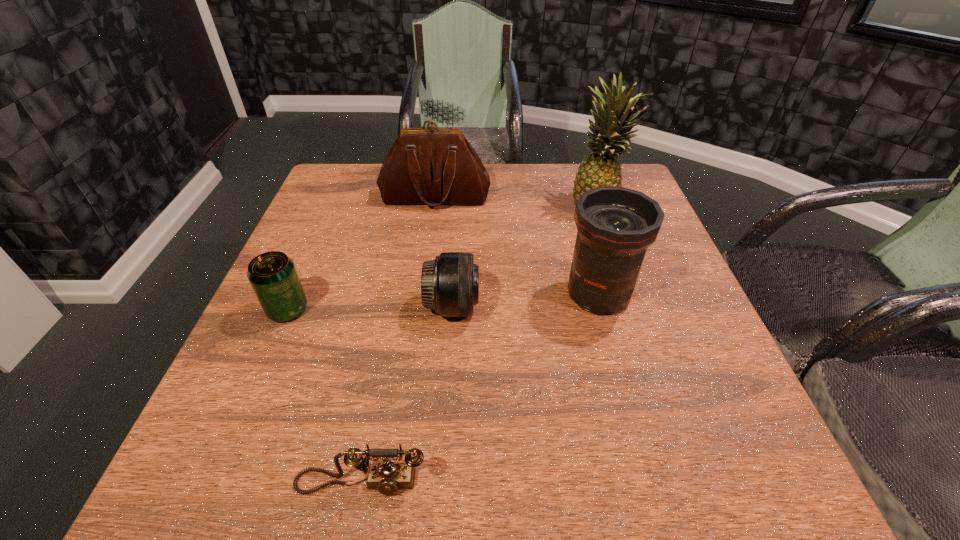
The image size is (960, 540). Find the location of `free space located 0.110m on the front-facing side of the shorter telephoto lens`. free space located 0.110m on the front-facing side of the shorter telephoto lens is located at coordinates (532, 307).

Where is `vacant area located 0.280m on the front of the beer can`? The width and height of the screenshot is (960, 540). vacant area located 0.280m on the front of the beer can is located at coordinates (220, 465).

This screenshot has width=960, height=540. In order to click on pineapple at the far edge in this screenshot , I will do `click(610, 132)`.

This screenshot has width=960, height=540. What are the coordinates of `shoulder bag at the far edge` in the screenshot? It's located at (431, 166).

Locate an element on the screen. object that is at the near edge is located at coordinates (387, 477).

Where is `object located in the left edge section of the desktop`? Image resolution: width=960 pixels, height=540 pixels. object located in the left edge section of the desktop is located at coordinates (273, 276).

Where is `pineapple positioned at the right edge`? The image size is (960, 540). pineapple positioned at the right edge is located at coordinates (610, 132).

The image size is (960, 540). I want to click on telephoto lens that is at the right edge, so click(616, 225).

Identify the location of object present at the far right corner. This screenshot has height=540, width=960. (610, 132).

The height and width of the screenshot is (540, 960). Find the location of `vacant space at the far edge of the desktop`. vacant space at the far edge of the desktop is located at coordinates (442, 208).